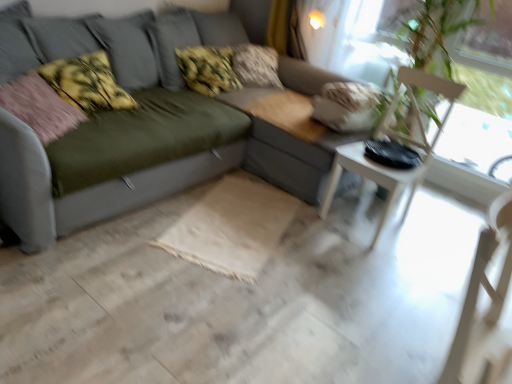
The height and width of the screenshot is (384, 512). I want to click on vacant area that lies between white wood chair at right, which ranks as the second armchair in front-to-back order, and white wood armchair at right, placed as the second armchair when sorted from back to front, so pos(388,288).